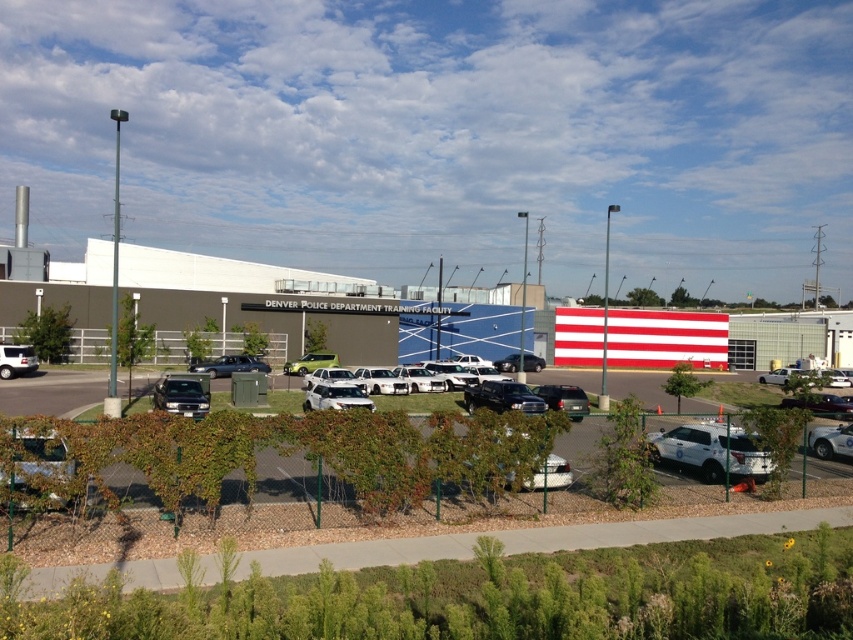
Is matte black suv at center-left bigger than white matte sedan at center?

Correct, matte black suv at center-left is larger in size than white matte sedan at center.

Does matte black suv at center-left have a smaller size compared to white matte sedan at center?

No.

Where is `matte black suv at center-left`? matte black suv at center-left is located at coordinates (181, 394).

Locate an element on the screen. The width and height of the screenshot is (853, 640). matte black suv at center-left is located at coordinates (181, 394).

Does white matte vehicles at center have a smaller size compared to white matte sedan at center?

Actually, white matte vehicles at center might be larger than white matte sedan at center.

Looking at this image, between white matte vehicles at center and white matte sedan at center, which one appears on the right side from the viewer's perspective?

white matte vehicles at center is more to the right.

This screenshot has width=853, height=640. Identify the location of white matte vehicles at center. coord(55,390).

Can you confirm if white matte sedan at center is bigger than matte black sedan at center?

No.

Which is more to the left, white matte sedan at center or matte black sedan at center?

From the viewer's perspective, white matte sedan at center appears more on the left side.

This screenshot has height=640, width=853. Describe the element at coordinates (335, 396) in the screenshot. I see `white matte sedan at center` at that location.

I want to click on white matte sedan at center, so click(335, 396).